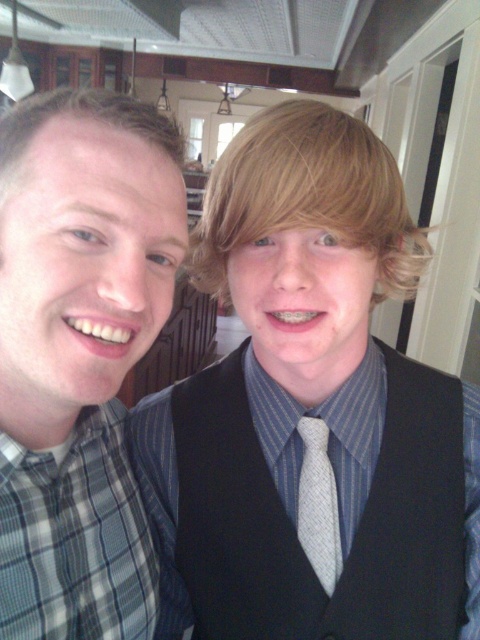
Looking at this image, you are a photographer setting up for a family portrait. You need to ensure that both the matte black vest at center and the light gray textured tie at center are visible in the photo. Based on their positions, which one might be partially hidden if you frame the shot too tightly?

The light gray textured tie at center might be partially hidden because the matte black vest at center is in front of it, so if the frame is too tight, the vest could block part of the tie.

You are standing in the center of the room and want to hand a gift to the person wearing the plaid shirt at left. Based on their position, in which direction should you move to reach them?

The plaid shirt at left is positioned at point 0.555 on the x axis and 0.167 on the y axis. Since you are at the center, you should move to the left and slightly forward to reach the person wearing the plaid shirt at left.

You are a photographer standing in front of the two men. You want to take a photo of the light gray textured tie at center without the plaid shirt at left appearing in the background. Is this possible?

The plaid shirt at left is in front of the light gray textured tie at center, so it would block the view of the tie. Therefore, you cannot take a photo of the light gray textured tie at center without the plaid shirt at left appearing in the background.